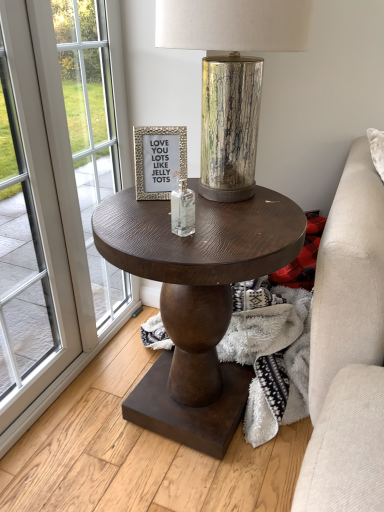
Locate an element on the screen. free spot to the left of clear glass bottle at center is located at coordinates (131, 226).